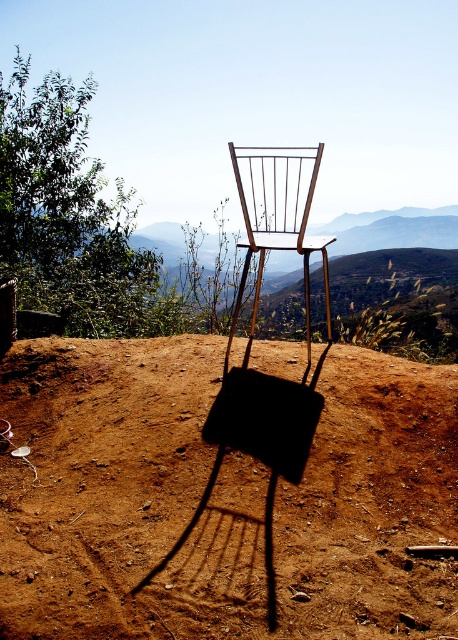
You are standing at the point marked as point (x=221, y=499) in the image. Looking around, you see the brown dirt field at center. What is directly beneath your feet?

The point (x=221, y=499) is where the brown dirt field at center is located, so the ground beneath your feet is the brown dirt field at center.

In the scene shown: You are standing at the origin point of the image coordinate system. Where is the metallic wire chair at center located?

The metallic wire chair at center is located at point (259, 442).

You are standing in front of the chair in the image and want to place a small flag at two specific points marked as point (4, 380) and point (296, 401). Which point is closer to you when you are facing the chair?

Point (4, 380) is closer to you than point (296, 401) because it is further to the viewer.